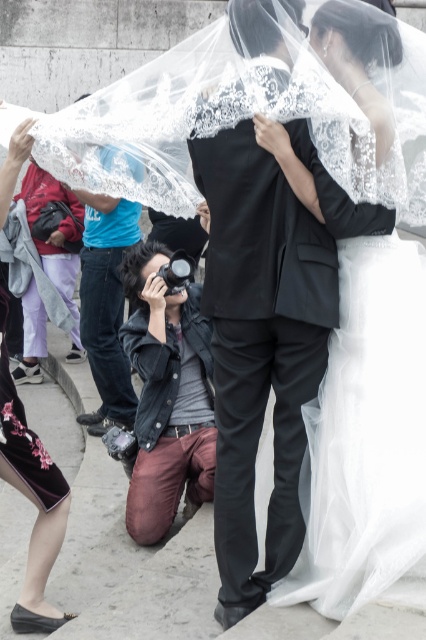
Question: Which point appears farthest from the camera in this image?

Choices:
 (A) (414, 120)
 (B) (106, 198)
 (C) (210, 396)
 (D) (20, 618)

Answer: (B)

Question: Among these points, which one is nearest to the camera?

Choices:
 (A) (129, 285)
 (B) (425, 509)

Answer: (B)

Question: Is denim jacket at lower center smaller than matte black camera at center?

Choices:
 (A) no
 (B) yes

Answer: (B)

Question: Where is white lace veil at center located in relation to denim jacket at lower center in the image?

Choices:
 (A) left
 (B) right

Answer: (B)

Question: Can you confirm if denim jacket at lower center is wider than velvet skirt at lower left?

Choices:
 (A) no
 (B) yes

Answer: (B)

Question: Which object is closer to the camera taking this photo?

Choices:
 (A) white lace veil at center
 (B) matte black camera at center
 (C) denim jacket at lower center

Answer: (A)